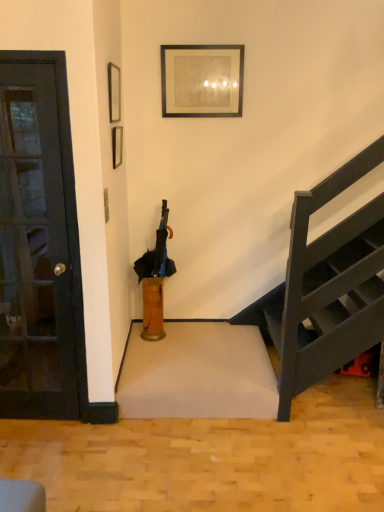
I want to click on translucent glass vase at center, so click(x=153, y=309).

I want to click on black matte umbrella at center, so click(157, 253).

What do you see at coordinates (114, 92) in the screenshot?
I see `matte black picture frame at upper left, which appears as the second picture frame when viewed from the back` at bounding box center [114, 92].

This screenshot has height=512, width=384. Find the location of `translucent glass vase at center`. translucent glass vase at center is located at coordinates (153, 309).

Which is correct: matte black picture frame at upper left, marked as the first picture frame in a left-to-right arrangement, is inside translucent glass vase at center, or outside of it?

matte black picture frame at upper left, marked as the first picture frame in a left-to-right arrangement, cannot be found inside translucent glass vase at center.

Which object is thinner, matte black picture frame at upper left, which appears as the first picture frame when viewed from the front, or translucent glass vase at center?

With smaller width is matte black picture frame at upper left, which appears as the first picture frame when viewed from the front.

From the image's perspective, starting from the translucent glass vase at center, which picture frame is the 1st one above? Please provide its 2D coordinates.

[(114, 92)]

Is black matte picture frame at upper center, the second picture frame positioned from the left, aimed at black glass door at left?

No, black matte picture frame at upper center, the second picture frame positioned from the left, is not turned towards black glass door at left.

Which is more to the left, black matte picture frame at upper center, the first picture frame positioned from the back, or black glass door at left?

black glass door at left.

Between black matte picture frame at upper center, which appears as the first picture frame when viewed from the right, and black glass door at left, which one is positioned behind?

black matte picture frame at upper center, which appears as the first picture frame when viewed from the right, is behind.

From a real-world perspective, is black matte picture frame at upper center, which appears as the first picture frame when viewed from the right, above or below black glass door at left?

black matte picture frame at upper center, which appears as the first picture frame when viewed from the right, is above black glass door at left.

From the image's perspective, is black matte picture frame at upper center, which appears as the first picture frame when viewed from the right, located beneath matte black picture frame at upper left, the second picture frame viewed from the right?

Incorrect, from the image's perspective, black matte picture frame at upper center, which appears as the first picture frame when viewed from the right, is higher than matte black picture frame at upper left, the second picture frame viewed from the right.

Based on the photo, is black matte picture frame at upper center, the second picture frame positioned from the left, shorter than matte black picture frame at upper left, which appears as the second picture frame when viewed from the back?

In fact, black matte picture frame at upper center, the second picture frame positioned from the left, may be taller than matte black picture frame at upper left, which appears as the second picture frame when viewed from the back.

Is point (211, 115) positioned after point (118, 77)?

Yes.

From a real-world perspective, is black matte umbrella at center below black glass door at left?

Correct, in the physical world, black matte umbrella at center is lower than black glass door at left.

Which of these two, black matte umbrella at center or black glass door at left, is bigger?

black glass door at left is bigger.

In the image, is black matte umbrella at center on the left side or the right side of black glass door at left?

From the image, it's evident that black matte umbrella at center is to the right of black glass door at left.

Is point (153, 277) farther from viewer compared to point (8, 212)?

Yes, it is behind point (8, 212).

Does point (59, 407) come farther from viewer compared to point (117, 112)?

No, (59, 407) is closer to viewer.

From the image's perspective, is black glass door at left above matte black picture frame at upper left, which appears as the second picture frame when viewed from the back?

No, from the image's perspective, black glass door at left is not on top of matte black picture frame at upper left, which appears as the second picture frame when viewed from the back.

The image size is (384, 512). In order to click on the 1st picture frame to the right of the black glass door at left, counting from the anchor's position in this screenshot , I will do `click(114, 92)`.

Is matte black picture frame at upper left, the second picture frame viewed from the right, at the back of black glass door at left?

No.

Is black matte umbrella at center looking in the opposite direction of translucent glass vase at center?

No.

I want to click on vase behind the black matte umbrella at center, so click(x=153, y=309).

Is translucent glass vase at center completely or partially inside black matte umbrella at center?

No, translucent glass vase at center is not inside black matte umbrella at center.

Which is behind, point (162, 272) or point (154, 287)?

The point (154, 287) is more distant.

Are translucent glass vase at center and black matte picture frame at upper center, which appears as the first picture frame when viewed from the right, beside each other?

translucent glass vase at center and black matte picture frame at upper center, which appears as the first picture frame when viewed from the right, are not in contact.

Between translucent glass vase at center and black matte picture frame at upper center, which is the second picture frame from front to back, which one has larger size?

black matte picture frame at upper center, which is the second picture frame from front to back.

Can you confirm if translucent glass vase at center is thinner than black matte picture frame at upper center, the second picture frame positioned from the left?

In fact, translucent glass vase at center might be wider than black matte picture frame at upper center, the second picture frame positioned from the left.

Would you say translucent glass vase at center is outside black matte picture frame at upper center, the second picture frame positioned from the left?

translucent glass vase at center lies outside black matte picture frame at upper center, the second picture frame positioned from the left,'s area.

Locate an element on the screen. vase to the right of matte black picture frame at upper left, which appears as the second picture frame when viewed from the back is located at coordinates point(153,309).

Find the location of a particular element. door that appears below the black matte picture frame at upper center, the first picture frame positioned from the back (from a real-world perspective) is located at coordinates (34, 250).

Which object lies nearer to the anchor point translucent glass vase at center, black glass door at left or black matte picture frame at upper center, the second picture frame positioned from the left?

black glass door at left is closer to translucent glass vase at center.

Estimate the real-world distances between objects in this image. Which object is further from black glass door at left, black matte umbrella at center or matte black picture frame at upper left, marked as the first picture frame in a left-to-right arrangement?

matte black picture frame at upper left, marked as the first picture frame in a left-to-right arrangement.

Looking at the image, which one is located closer to matte black picture frame at upper left, marked as the first picture frame in a left-to-right arrangement, translucent glass vase at center or black glass door at left?

black glass door at left lies closer to matte black picture frame at upper left, marked as the first picture frame in a left-to-right arrangement, than the other object.

When comparing their distances from black glass door at left, does matte black picture frame at upper left, which appears as the first picture frame when viewed from the front, or black matte picture frame at upper center, the first picture frame positioned from the back, seem further?

black matte picture frame at upper center, the first picture frame positioned from the back.

Estimate the real-world distances between objects in this image. Which object is further from translucent glass vase at center, matte black picture frame at upper left, which appears as the second picture frame when viewed from the back, or black matte umbrella at center?

matte black picture frame at upper left, which appears as the second picture frame when viewed from the back, lies further to translucent glass vase at center than the other object.

When comparing their distances from translucent glass vase at center, does black matte picture frame at upper center, the first picture frame positioned from the back, or black matte umbrella at center seem closer?

black matte umbrella at center is closer to translucent glass vase at center.

Looking at the image, which one is located closer to matte black picture frame at upper left, which appears as the first picture frame when viewed from the front, translucent glass vase at center or black matte picture frame at upper center, the first picture frame positioned from the back?

black matte picture frame at upper center, the first picture frame positioned from the back, is positioned closer to the anchor matte black picture frame at upper left, which appears as the first picture frame when viewed from the front.

From the image, which object appears to be farther from black matte picture frame at upper center, which appears as the first picture frame when viewed from the right, black glass door at left or matte black picture frame at upper left, which appears as the first picture frame when viewed from the front?

Among the two, black glass door at left is located further to black matte picture frame at upper center, which appears as the first picture frame when viewed from the right.

This screenshot has width=384, height=512. What are the coordinates of `picture frame between black matte picture frame at upper center, the second picture frame positioned from the left, and black matte umbrella at center vertically` in the screenshot? It's located at (114, 92).

Identify the location of umbrella between black matte picture frame at upper center, the second picture frame positioned from the left, and translucent glass vase at center in the up-down direction. (157, 253).

You are a GUI agent. You are given a task and a screenshot of the screen. Output one action in this format:
    pyautogui.click(x=<x>, y=<y>)
    Task: Click on the umbrella between black matte picture frame at upper center, which is the second picture frame from front to back, and black glass door at left, in the vertical direction
    
    Given the screenshot: What is the action you would take?
    pyautogui.click(x=157, y=253)

Locate an element on the screen. This screenshot has width=384, height=512. umbrella between matte black picture frame at upper left, marked as the first picture frame in a left-to-right arrangement, and translucent glass vase at center from top to bottom is located at coordinates (157, 253).